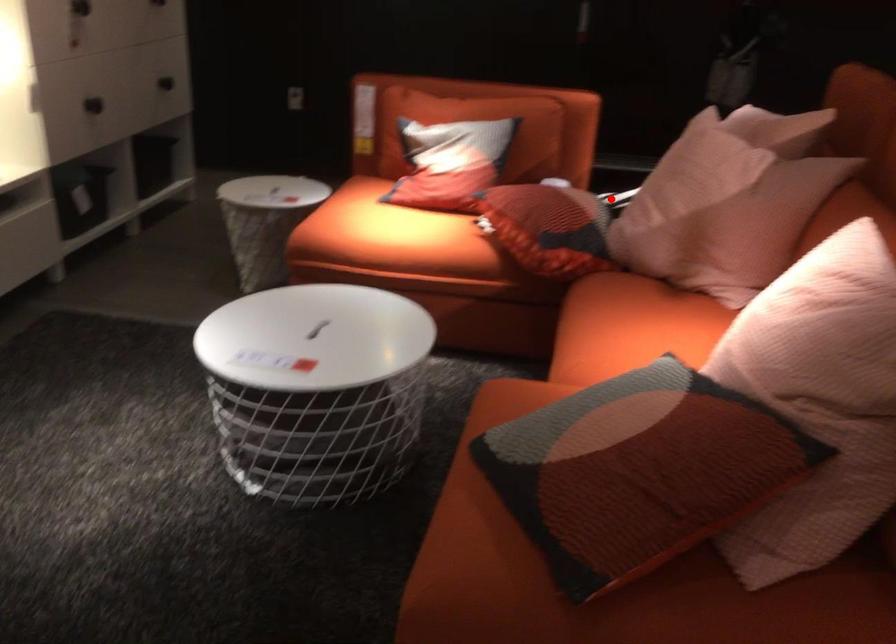
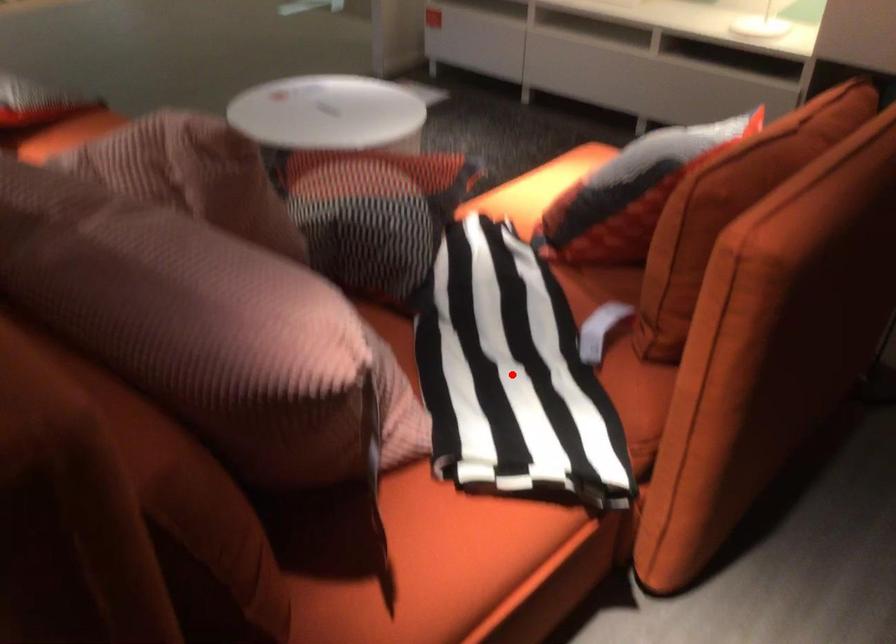
I am providing you with two images of the same scene from different viewpoints. A red point is marked on the first image and another point is marked on the second image. Does the point marked in image1 correspond to the same location as the one in image2?

Yes